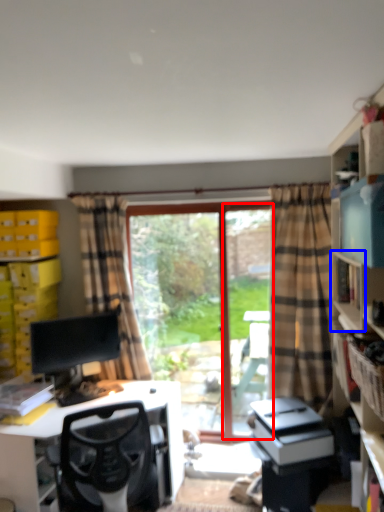
Question: Among these objects, which one is farthest to the camera, screen door (highlighted by a red box) or shelf (highlighted by a blue box)?

Choices:
 (A) screen door
 (B) shelf

Answer: (A)